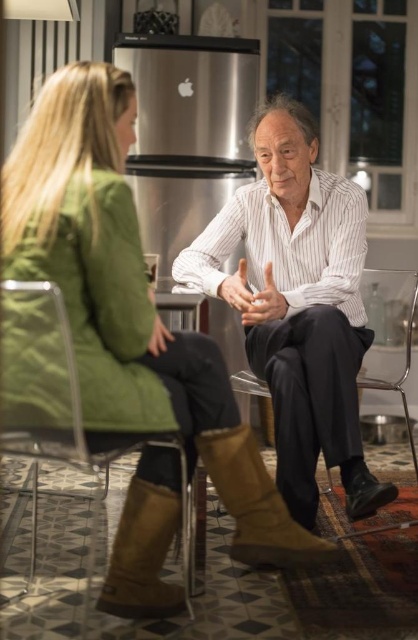
Is brown suede boot at lower center to the left of matte brown hand at center from the viewer's perspective?

Indeed, brown suede boot at lower center is positioned on the left side of matte brown hand at center.

Does point (231, 429) lie behind point (280, 300)?

That is False.

Between point (237, 440) and point (267, 291), which one is positioned behind?

The point (267, 291) is behind.

Locate an element on the screen. The height and width of the screenshot is (640, 418). brown suede boot at lower center is located at coordinates (254, 502).

Between transparent plastic chair at center and matte white hand at center, which one appears on the left side from the viewer's perspective?

matte white hand at center

Which is below, transparent plastic chair at center or matte white hand at center?

transparent plastic chair at center

Does point (400, 388) lie behind point (229, 280)?

Yes, it is.

I want to click on transparent plastic chair at center, so click(404, 368).

Can you confirm if green suede boots at lower center is shorter than white striped shirt at center?

Indeed, green suede boots at lower center has a lesser height compared to white striped shirt at center.

Measure the distance between point (45, 193) and camera.

The distance of point (45, 193) from camera is 4.87 feet.

Identify the location of green suede boots at lower center. Image resolution: width=418 pixels, height=640 pixels. (129, 301).